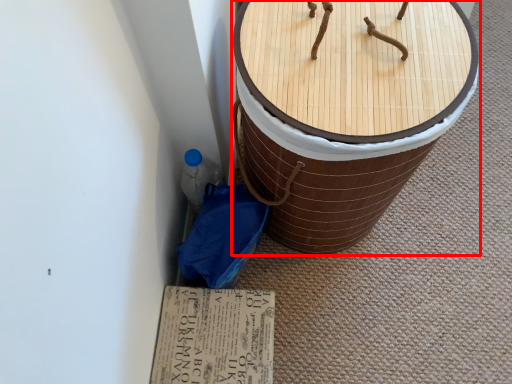
Question: Considering the relative positions of furniture (annotated by the red box) and cardboard in the image provided, where is furniture (annotated by the red box) located with respect to the staircase?

Choices:
 (A) left
 (B) right

Answer: (B)